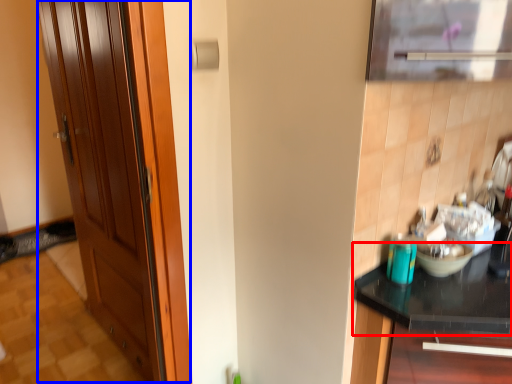
Question: Among these objects, which one is farthest to the camera, countertop (highlighted by a red box) or door (highlighted by a blue box)?

Choices:
 (A) countertop
 (B) door

Answer: (B)